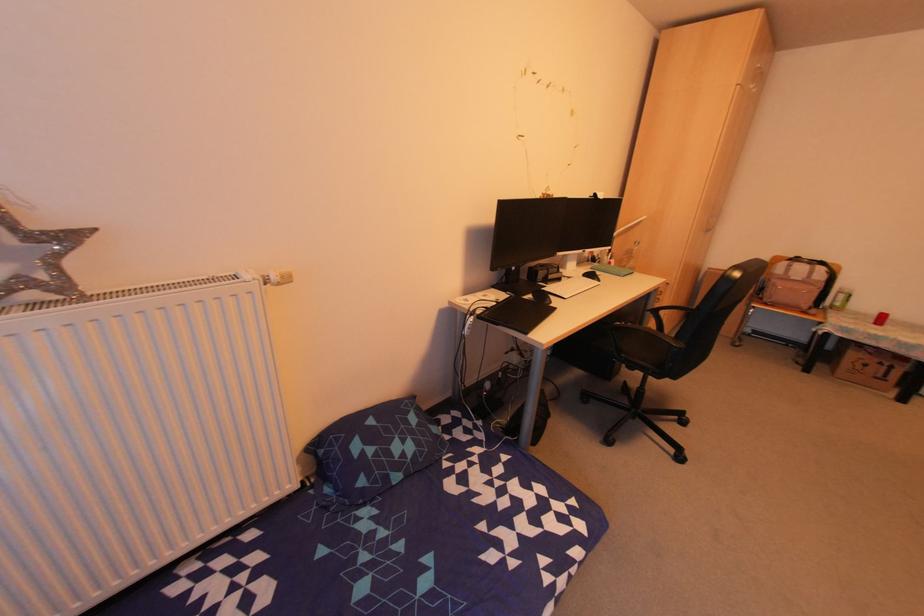
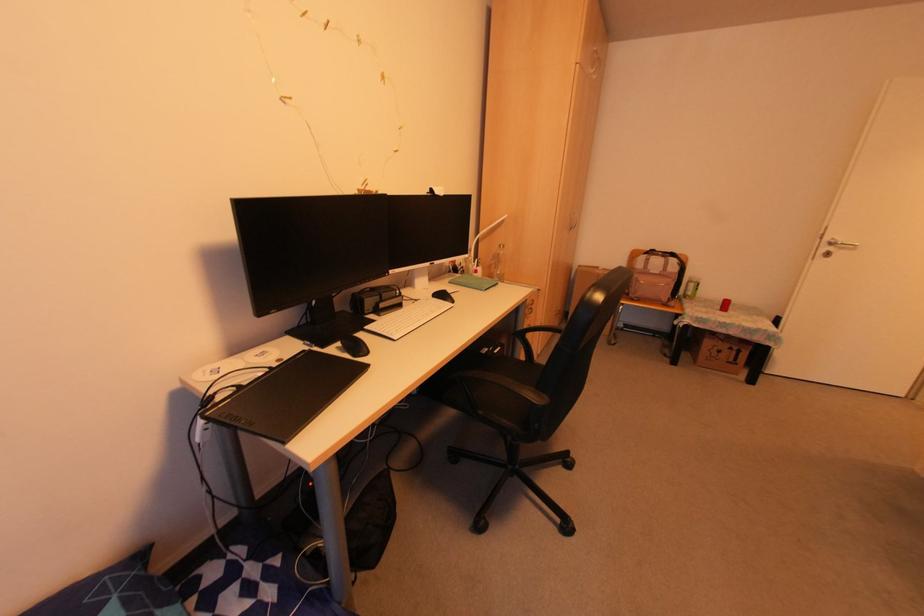
Locate, in the second image, the point that corresponds to pixel 653 312 in the first image.

(518, 334)